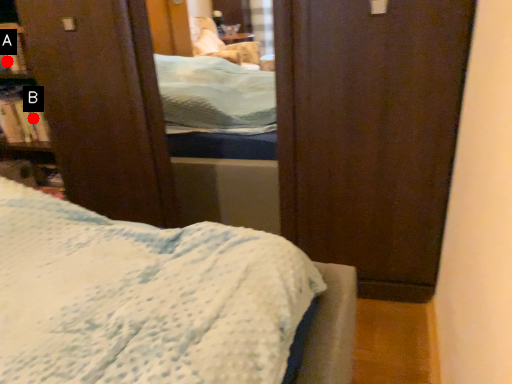
Question: Two points are circled on the image, labeled by A and B beside each circle. Which point is further to the camera?

Choices:
 (A) A is further
 (B) B is further

Answer: (B)